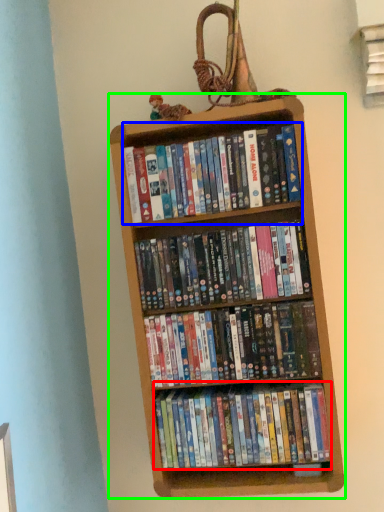
Question: Based on their relative distances, which object is nearer to book (highlighted by a red box)? Choose from book (highlighted by a blue box) and bookcase (highlighted by a green box).

Choices:
 (A) book
 (B) bookcase

Answer: (B)